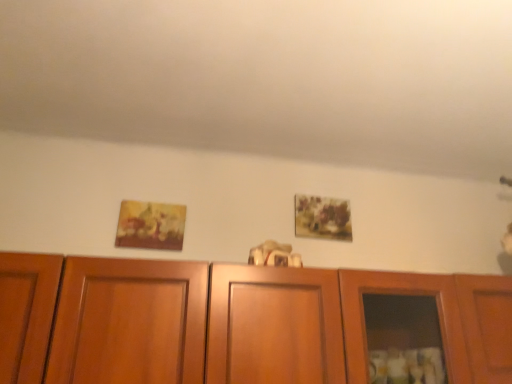
Question: Can you confirm if matte floral painting at upper center, marked as the first picture frame in a right-to-left arrangement, is positioned to the right of wooden cabinet at center?

Choices:
 (A) no
 (B) yes

Answer: (B)

Question: Could you tell me if matte floral painting at upper center, the 2th picture frame positioned from the front, is turned towards wooden cabinet at center?

Choices:
 (A) no
 (B) yes

Answer: (A)

Question: From a real-world perspective, does matte floral painting at upper center, placed as the 2th picture frame when sorted from left to right, stand above wooden cabinet at center?

Choices:
 (A) no
 (B) yes

Answer: (B)

Question: Is matte floral painting at upper center, placed as the 2th picture frame when sorted from left to right, positioned in front of wooden cabinet at center?

Choices:
 (A) yes
 (B) no

Answer: (B)

Question: Does matte floral painting at upper center, the 2th picture frame positioned from the front, touch wooden cabinet at center?

Choices:
 (A) yes
 (B) no

Answer: (B)

Question: Considering the positions of point (285, 326) and point (143, 201), is point (285, 326) closer or farther from the camera than point (143, 201)?

Choices:
 (A) closer
 (B) farther

Answer: (A)

Question: Is wooden cabinet at center wider or thinner than matte yellow painting at left, placed as the 1th picture frame when sorted from front to back?

Choices:
 (A) wide
 (B) thin

Answer: (A)

Question: Is wooden cabinet at center inside the boundaries of matte yellow painting at left, placed as the 1th picture frame when sorted from front to back, or outside?

Choices:
 (A) outside
 (B) inside

Answer: (A)

Question: In terms of height, does wooden cabinet at center look taller or shorter compared to matte yellow painting at left, positioned as the second picture frame in back-to-front order?

Choices:
 (A) short
 (B) tall

Answer: (B)

Question: From a real-world perspective, is matte yellow painting at left, placed as the 1th picture frame when sorted from front to back, above or below wooden cabinet at center?

Choices:
 (A) above
 (B) below

Answer: (A)

Question: In terms of width, does matte yellow painting at left, positioned as the second picture frame in right-to-left order, look wider or thinner when compared to wooden cabinet at center?

Choices:
 (A) thin
 (B) wide

Answer: (A)

Question: Choose the correct answer: Is matte yellow painting at left, which is the first picture frame in left-to-right order, inside wooden cabinet at center or outside it?

Choices:
 (A) outside
 (B) inside

Answer: (A)

Question: Is matte yellow painting at left, placed as the 1th picture frame when sorted from front to back, to the left or to the right of wooden cabinet at center in the image?

Choices:
 (A) left
 (B) right

Answer: (A)

Question: Is matte floral painting at upper center, placed as the 2th picture frame when sorted from left to right, inside or outside of matte yellow painting at left, positioned as the second picture frame in back-to-front order?

Choices:
 (A) inside
 (B) outside

Answer: (B)

Question: From a real-world perspective, is matte floral painting at upper center, the first picture frame viewed from the back, physically located above or below matte yellow painting at left, placed as the 1th picture frame when sorted from front to back?

Choices:
 (A) above
 (B) below

Answer: (A)